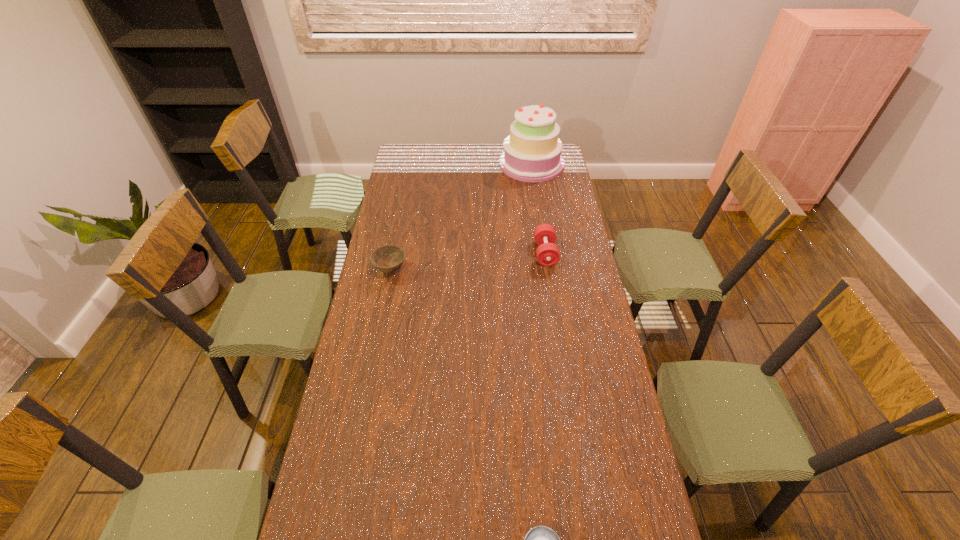
This screenshot has height=540, width=960. I want to click on the farthest object, so click(x=532, y=152).

Identify the location of cake. This screenshot has width=960, height=540. (532, 152).

Find the location of `dumbbell`. dumbbell is located at coordinates (547, 253).

Locate an element on the screen. bowl is located at coordinates click(x=388, y=258).

What are the coordinates of `free space located on the left of the tallest object` in the screenshot? It's located at (484, 164).

Find the location of a particular element. vacant area situated on the left of the dumbbell is located at coordinates [520, 253].

At what (x,y) coordinates should I click in order to perform the action: click on free space located on the back of the bowl. Please return your answer as a coordinate pair (x, y). This screenshot has width=960, height=540. Looking at the image, I should click on (397, 235).

In order to click on object at the far edge in this screenshot , I will do `click(532, 152)`.

At what (x,y) coordinates should I click in order to perform the action: click on object that is at the left edge. Please return your answer as a coordinate pair (x, y). Looking at the image, I should click on pos(388,258).

Identify the location of cake situated at the right edge. Image resolution: width=960 pixels, height=540 pixels. (532, 152).